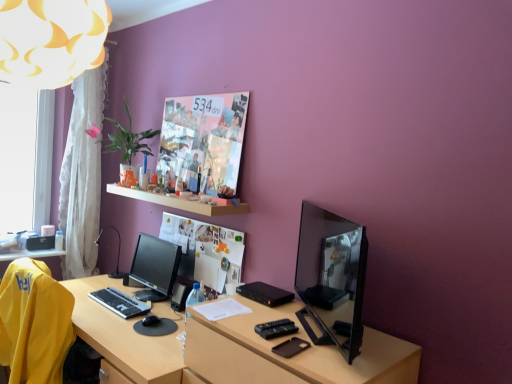
Identify the location of free space above wooden desk at center (from a real-world perspective). (117, 306).